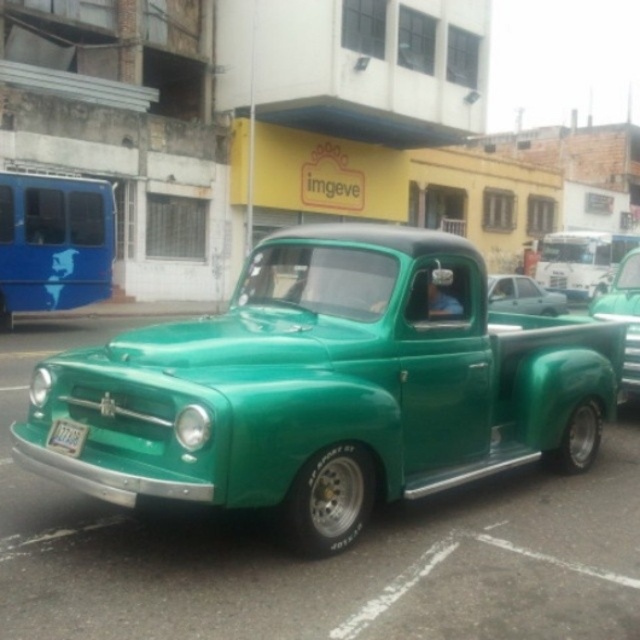
You are standing in front of the vintage green pickup truck and notice two points marked on the truck. The first point is at coordinates point (152, 625) and the second point is at point (72, 426). Which point is closer to you?

Point (152, 625) is in front of point (72, 426), so the first point is closer to you.

Looking at this image, you are a delivery driver who needs to park your green matte truck at center in a spot that requires the license plate to be visible. Is the green matte license plate at front positioned in a way that it can be seen when the truck is parked?

The green matte truck at center is to the right of the green matte license plate at front, so when parked, the license plate will be visible from the front of the truck as it is positioned in front of the truck.

Based on the photo, you are standing on the sidewalk in front of the yellow building and want to take a photo of the green matte truck at center and the green matte license plate at front. Which object will appear larger in your photo?

The green matte truck at center will appear larger in the photo because it is closer to you than the green matte license plate at front.